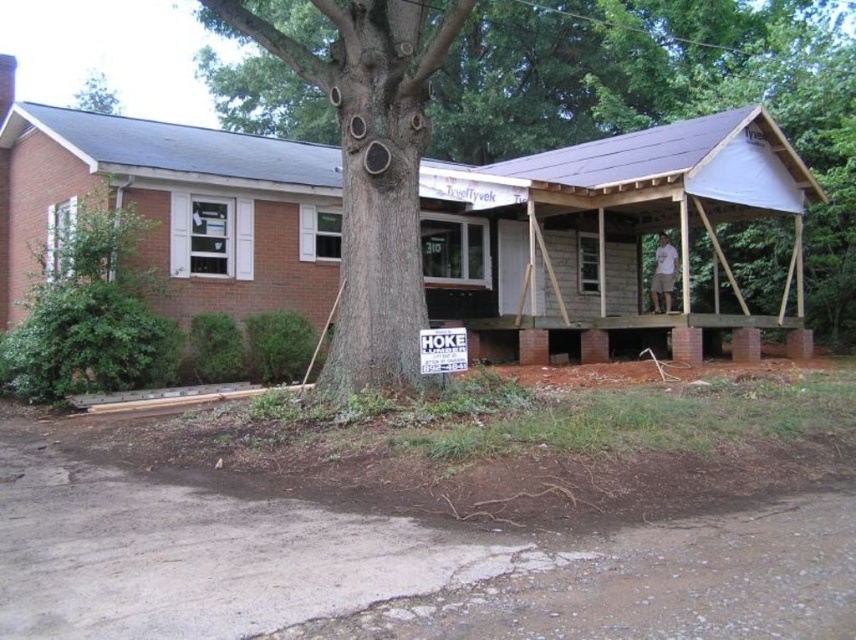
You are a contractor looking at the construction site. You need to determine if the white paper sign at center can be seen without obstruction from the green rough bark tree at upper center. Can you see the sign clearly?

The white paper sign at center is in front of the green rough bark tree at upper center, so yes, the sign is visible without obstruction from the tree.

You are a construction worker on the site. You need to determine which object is taller between the brown rough bark tree at center and the gray textured tree trunk at center. Based on the scene, which one is taller?

The brown rough bark tree at center is taller than the gray textured tree trunk at center.

You are a contractor checking the construction site. You need to determine which tree trunk is bigger between the gray textured tree trunk at center and the green rough bark tree at upper center. Which one is larger?

The gray textured tree trunk at center has a larger size compared to the green rough bark tree at upper center.